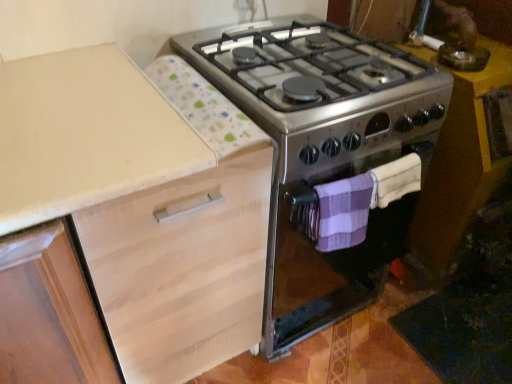
Question: From the image's perspective, is metallic yellow table at right located above or below stainless steel stove at center?

Choices:
 (A) below
 (B) above

Answer: (B)

Question: Is point (428, 172) closer or farther from the camera than point (268, 59)?

Choices:
 (A) closer
 (B) farther

Answer: (B)

Question: Estimate the real-world distances between objects in this image. Which object is farther from the stainless steel stove at center?

Choices:
 (A) purple knitted towel at lower right, which is counted as the 2th blanket, starting from the left
 (B) metallic yellow table at right
 (C) purple striped towel at lower right, arranged as the second blanket when viewed from the right
 (D) light wood cabinet at upper left

Answer: (B)

Question: Considering the real-world distances, which object is closest to the purple striped towel at lower right, arranged as the second blanket when viewed from the right?

Choices:
 (A) purple knitted towel at lower right, acting as the first blanket starting from the right
 (B) stainless steel stove at center
 (C) light wood cabinet at upper left
 (D) metallic yellow table at right

Answer: (A)